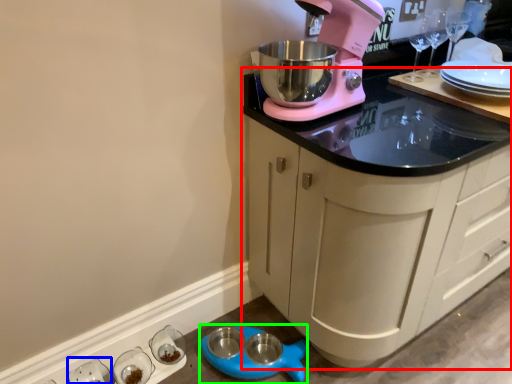
Question: Which object is the farthest from cabinetry (highlighted by a red box)? Choose among these: tableware (highlighted by a blue box) or appliance (highlighted by a green box).

Choices:
 (A) tableware
 (B) appliance

Answer: (A)